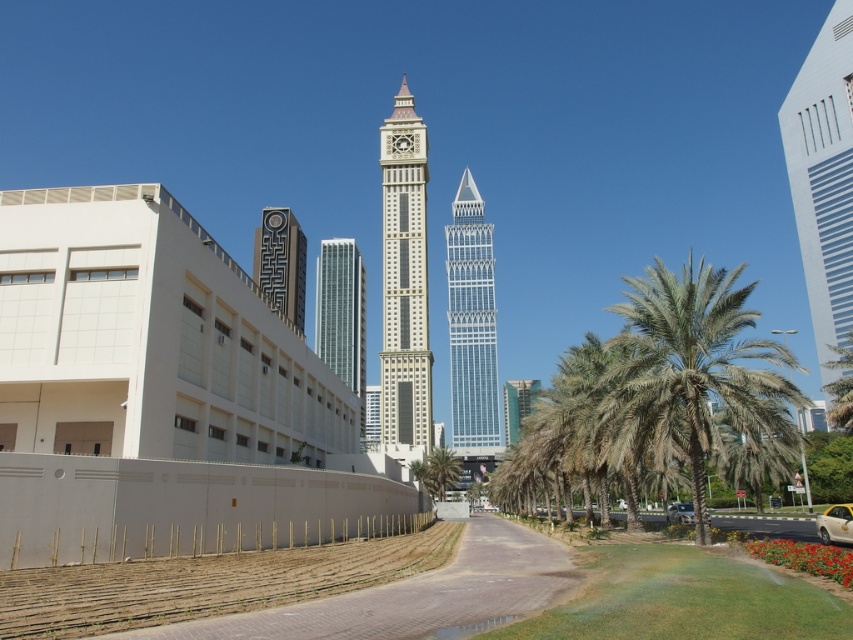
Question: Does white smooth building at right come in front of silver glass skyscraper at center?

Choices:
 (A) no
 (B) yes

Answer: (B)

Question: Which point is farther to the camera?

Choices:
 (A) green leafy palm tree at right
 (B) green glass building at center

Answer: (B)

Question: Is green glass building at center to the left of green leafy palm tree at center from the viewer's perspective?

Choices:
 (A) no
 (B) yes

Answer: (A)

Question: Among these points, which one is farthest from the camera?

Choices:
 (A) (469, 198)
 (B) (527, 392)
 (C) (689, 502)

Answer: (A)

Question: Is white smooth building at right to the left of metallic silver car at lower right from the viewer's perspective?

Choices:
 (A) no
 (B) yes

Answer: (A)

Question: Which of the following is the closest to the observer?

Choices:
 (A) (398, 381)
 (B) (843, 326)
 (C) (477, 200)
 (D) (839, 525)

Answer: (D)